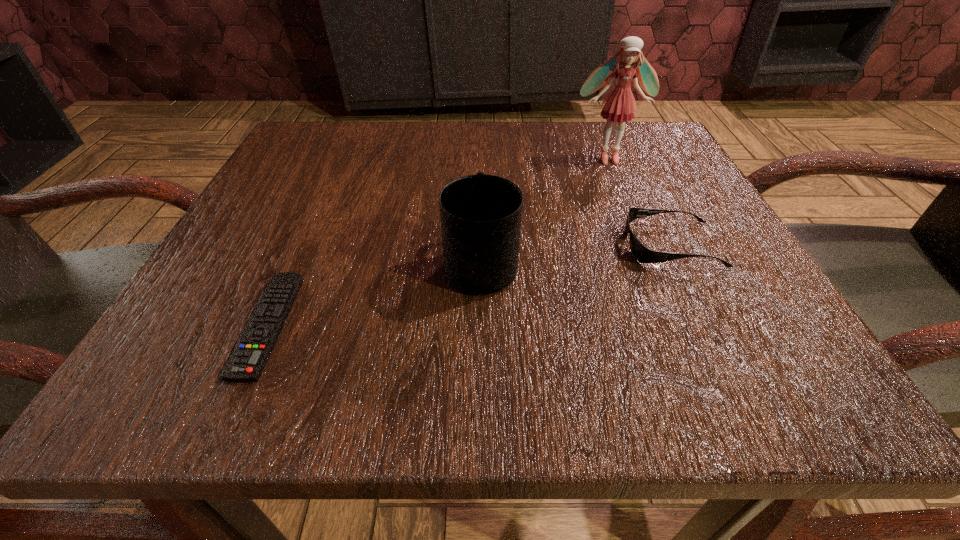
Find the location of a particular element. This screenshot has height=540, width=960. object that is positioned at the near left corner is located at coordinates coord(246,363).

At what (x,y) coordinates should I click in order to perform the action: click on object present at the far right corner. Please return your answer as a coordinate pair (x, y). This screenshot has width=960, height=540. Looking at the image, I should click on (619, 106).

This screenshot has height=540, width=960. Identify the location of vacant area at the far edge. (544, 158).

You are a GUI agent. You are given a task and a screenshot of the screen. Output one action in this format:
    pyautogui.click(x=<x>, y=<y>)
    Task: Click on the free space at the near edge of the desktop
    Image resolution: width=960 pixels, height=540 pixels.
    Given the screenshot: What is the action you would take?
    pyautogui.click(x=297, y=368)

At what (x,y) coordinates should I click in order to perform the action: click on vacant region at the left edge of the desktop. Please return your answer as a coordinate pair (x, y). The image size is (960, 540). Looking at the image, I should click on (286, 197).

At what (x,y) coordinates should I click in order to perform the action: click on free space at the right edge of the desktop. Please return your answer as a coordinate pair (x, y). The image size is (960, 540). Looking at the image, I should click on (753, 295).

You are a GUI agent. You are given a task and a screenshot of the screen. Output one action in this format:
    pyautogui.click(x=<x>, y=<y>)
    Task: Click on the vacant space at the far left corner
    The height and width of the screenshot is (540, 960).
    Given the screenshot: What is the action you would take?
    pyautogui.click(x=331, y=126)

Image resolution: width=960 pixels, height=540 pixels. Find the location of `free spot at the far right corner of the desktop`. free spot at the far right corner of the desktop is located at coordinates (660, 143).

Locate an element on the screen. The width and height of the screenshot is (960, 540). vacant area at the near right corner is located at coordinates (723, 364).

Find the location of a particular element. The image size is (960, 540). free space between the leftmost object and the doll is located at coordinates (438, 241).